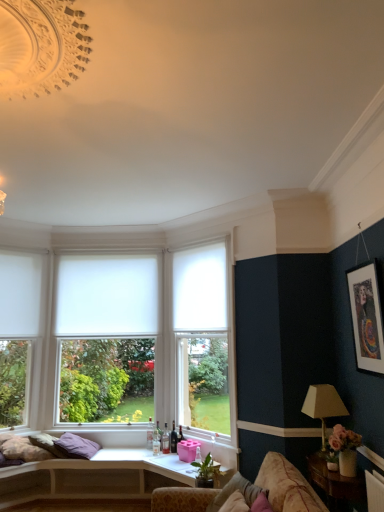
Question: Can you confirm if white fabric lampshade at right is positioned to the left of purple fabric pillow at lower left, marked as the first pillow in a left-to-right arrangement?

Choices:
 (A) yes
 (B) no

Answer: (B)

Question: Would you say white fabric lampshade at right is a long distance from purple fabric pillow at lower left, acting as the 1th pillow starting from the back?

Choices:
 (A) yes
 (B) no

Answer: (A)

Question: Is the position of white fabric lampshade at right more distant than that of purple fabric pillow at lower left, arranged as the second pillow when viewed from the top?

Choices:
 (A) yes
 (B) no

Answer: (B)

Question: Is white fabric lampshade at right with purple fabric pillow at lower left, arranged as the second pillow when viewed from the top?

Choices:
 (A) no
 (B) yes

Answer: (A)

Question: From the image's perspective, is white fabric lampshade at right above purple fabric pillow at lower left, acting as the 1th pillow starting from the back?

Choices:
 (A) yes
 (B) no

Answer: (A)

Question: Is white fabric lampshade at right not inside purple fabric pillow at lower left, arranged as the second pillow when viewed from the top?

Choices:
 (A) yes
 (B) no

Answer: (A)

Question: Considering the relative sizes of wooden side table at lower right and purple fabric pillow at lower left, marked as the first pillow in a bottom-to-top arrangement, in the image provided, is wooden side table at lower right smaller than purple fabric pillow at lower left, marked as the first pillow in a bottom-to-top arrangement,?

Choices:
 (A) yes
 (B) no

Answer: (B)

Question: Considering the relative sizes of wooden side table at lower right and purple fabric pillow at lower left, acting as the 1th pillow starting from the back, in the image provided, is wooden side table at lower right thinner than purple fabric pillow at lower left, acting as the 1th pillow starting from the back,?

Choices:
 (A) no
 (B) yes

Answer: (B)

Question: From a real-world perspective, does wooden side table at lower right sit lower than purple fabric pillow at lower left, placed as the second pillow when sorted from right to left?

Choices:
 (A) yes
 (B) no

Answer: (A)

Question: From a real-world perspective, does wooden side table at lower right stand above purple fabric pillow at lower left, acting as the 1th pillow starting from the back?

Choices:
 (A) no
 (B) yes

Answer: (A)

Question: Does wooden side table at lower right touch purple fabric pillow at lower left, marked as the first pillow in a left-to-right arrangement?

Choices:
 (A) yes
 (B) no

Answer: (B)

Question: From the image's perspective, is wooden side table at lower right below purple fabric pillow at lower left, acting as the second pillow starting from the front?

Choices:
 (A) yes
 (B) no

Answer: (B)

Question: Are white matte window at center, arranged as the 1th window when viewed from the right, and purple fabric pillow at lower left, arranged as the second pillow when viewed from the top, making contact?

Choices:
 (A) yes
 (B) no

Answer: (B)